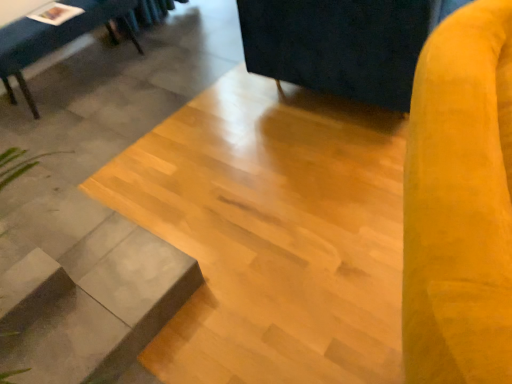
Question: Would you say gray concrete at lower left is inside or outside velvet yellow swivel chair at right, which is counted as the first swivel chair, starting from the front?

Choices:
 (A) outside
 (B) inside

Answer: (A)

Question: From a real-world perspective, is gray concrete at lower left physically located above or below velvet yellow swivel chair at right, acting as the second swivel chair starting from the back?

Choices:
 (A) below
 (B) above

Answer: (A)

Question: Estimate the real-world distances between objects in this image. Which object is closer to the velvet yellow swivel chair at right, the 1th swivel chair viewed from the back?

Choices:
 (A) velvet yellow swivel chair at right, acting as the second swivel chair starting from the back
 (B) gray concrete at lower left
 (C) matte black table at upper left

Answer: (B)

Question: Based on their relative distances, which object is farther from the velvet yellow swivel chair at right, acting as the second swivel chair starting from the back?

Choices:
 (A) gray concrete at lower left
 (B) matte black table at upper left
 (C) velvet yellow swivel chair at right, which is counted as the 2th swivel chair, starting from the front

Answer: (B)